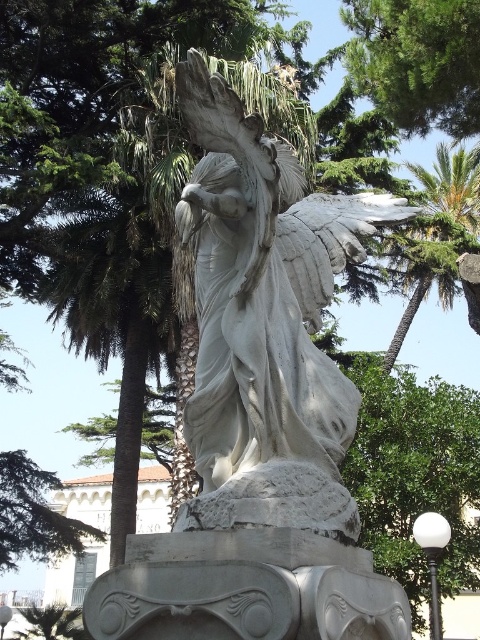
You are standing in the park and want to take a photo of the white marble statue at center. If you move 0.1 units to the right along the x axis, will you be closer to the statue?

The white marble statue at center is located at point [264,323]. Moving 0.1 units to the right along the x axis would bring you closer to the statue if your current position is to the left of it. However, without knowing your starting position, it is impossible to determine definitively. The statue is at the center, so moving right might not necessarily mean getting closer.

You are a park visitor standing near the white marble statue at center. You want to take a photo of the green leafy palm tree at upper right without the statue blocking the view. Is there enough space between them for you to move back and still capture the palm tree in your photo?

The distance between the white marble statue at center and the green leafy palm tree at upper right is 77.05 meters. Since the statue is at the center and the palm tree is 77 meters away, moving back slightly would still allow you to capture the palm tree without the statue blocking the view, as the distance is quite large.